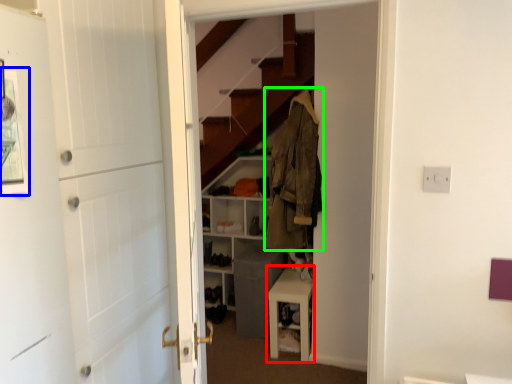
Question: Which object is positioned closest to table (highlighted by a red box)? Select from picture frame (highlighted by a blue box) and clothing (highlighted by a green box).

Choices:
 (A) picture frame
 (B) clothing

Answer: (B)